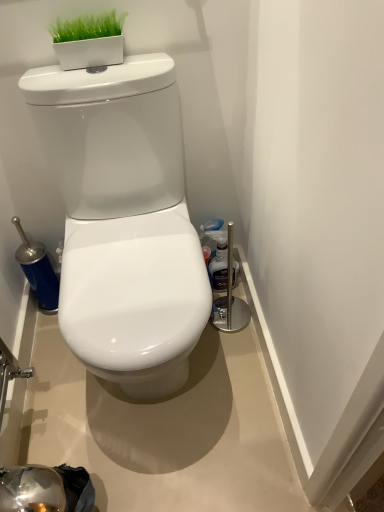
Question: Does clear plastic bottle at right have a greater height compared to white glossy toilet at center?

Choices:
 (A) yes
 (B) no

Answer: (B)

Question: Does clear plastic bottle at right have a lesser height compared to white glossy toilet at center?

Choices:
 (A) no
 (B) yes

Answer: (B)

Question: Could white glossy toilet at center be considered to be inside clear plastic bottle at right?

Choices:
 (A) yes
 (B) no

Answer: (B)

Question: Is clear plastic bottle at right behind white glossy toilet at center?

Choices:
 (A) yes
 (B) no

Answer: (A)

Question: Are clear plastic bottle at right and white glossy toilet at center located far from each other?

Choices:
 (A) no
 (B) yes

Answer: (A)

Question: Is clear plastic bottle at right in front of white glossy toilet at center?

Choices:
 (A) yes
 (B) no

Answer: (B)

Question: Is white glossy toilet at center surrounding clear plastic bottle at right?

Choices:
 (A) yes
 (B) no

Answer: (B)

Question: From the image's perspective, is white glossy toilet at center under clear plastic bottle at right?

Choices:
 (A) yes
 (B) no

Answer: (A)

Question: Is white glossy toilet at center wider than clear plastic bottle at right?

Choices:
 (A) yes
 (B) no

Answer: (A)

Question: Is white glossy toilet at center located outside clear plastic bottle at right?

Choices:
 (A) no
 (B) yes

Answer: (B)

Question: Is white glossy toilet at center shorter than clear plastic bottle at right?

Choices:
 (A) yes
 (B) no

Answer: (B)

Question: Is white glossy toilet at center directly adjacent to clear plastic bottle at right?

Choices:
 (A) yes
 (B) no

Answer: (B)

Question: From the image's perspective, is clear plastic bottle at right above or below white glossy toilet at center?

Choices:
 (A) above
 (B) below

Answer: (A)